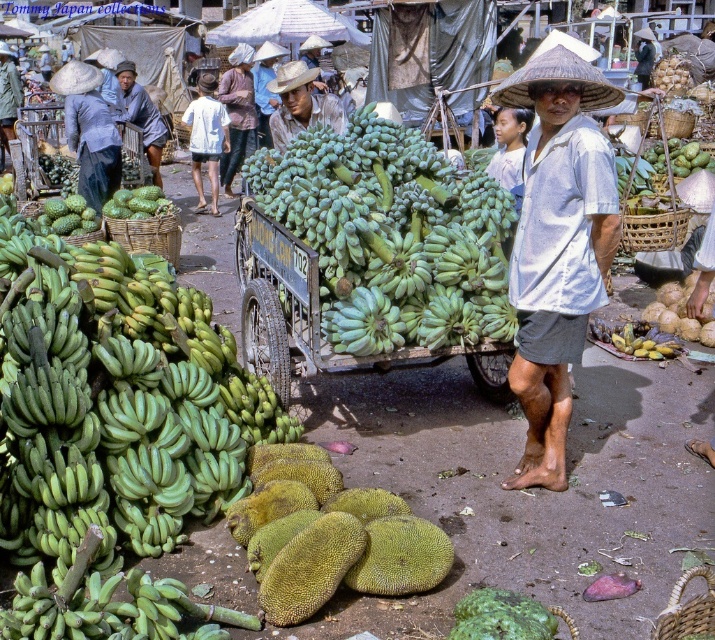
You are a customer at the market and want to know if the distance between the green rubber cart at center and the white cotton shirt at center is more than 20 feet. Can you confirm?

The green rubber cart at center and the white cotton shirt at center are 21.01 feet apart, so yes, the distance between them is more than 20 feet.

You are a customer at the market and want to buy the green matte jackfruit at center. The vendor is wearing a white cotton shirt at center. Where should you look to find the vendor compared to the jackfruit?

The vendor wearing the white cotton shirt at center is above the green matte jackfruit at center, so you should look upwards from the jackfruit to find the vendor.

You are a customer at the market and want to buy bananas. You see a green rubber cart at center and a light brown straw hat at center. Which object is closer to the right side of the market scene?

The green rubber cart at center is to the right of the light brown straw hat at center, so the green rubber cart at center is closer to the right side of the market scene.